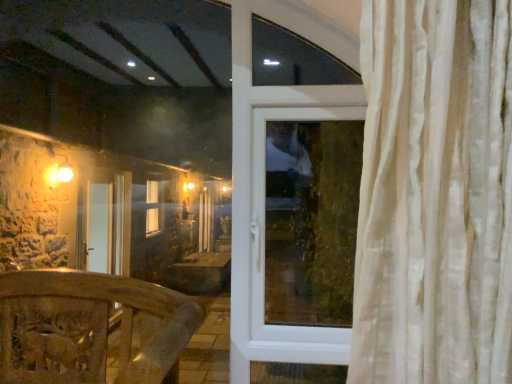
Describe the element at coordinates (92, 327) in the screenshot. This screenshot has height=384, width=512. I see `wooden carved railing at lower left` at that location.

What are the coordinates of `wooden carved railing at lower left` in the screenshot? It's located at (92, 327).

You are a GUI agent. You are given a task and a screenshot of the screen. Output one action in this format:
    pyautogui.click(x=<x>, y=<y>)
    Task: Click on the transparent glass window at center
    The width and height of the screenshot is (512, 384).
    Given the screenshot: What is the action you would take?
    pyautogui.click(x=304, y=219)

What do you see at coordinates (304, 219) in the screenshot?
I see `transparent glass window at center` at bounding box center [304, 219].

Identify the location of wooden carved railing at lower left. The height and width of the screenshot is (384, 512). (92, 327).

Is transparent glass window at center at the right side of wooden carved railing at lower left?

Yes.

Considering the relative positions of transparent glass window at center and wooden carved railing at lower left in the image provided, is transparent glass window at center in front of wooden carved railing at lower left?

That is False.

Which point is more forward, (268, 232) or (139, 359)?

Positioned in front is point (139, 359).

From the image's perspective, is transparent glass window at center on top of wooden carved railing at lower left?

Yes, from the image's perspective, transparent glass window at center is on top of wooden carved railing at lower left.

From a real-world perspective, is transparent glass window at center below wooden carved railing at lower left?

No, from a real-world perspective, transparent glass window at center is not under wooden carved railing at lower left.

From the picture: Can you confirm if transparent glass window at center is wider than wooden carved railing at lower left?

Incorrect, the width of transparent glass window at center does not surpass that of wooden carved railing at lower left.

Considering the sizes of transparent glass window at center and wooden carved railing at lower left in the image, is transparent glass window at center taller or shorter than wooden carved railing at lower left?

Clearly, transparent glass window at center is taller compared to wooden carved railing at lower left.

Can you confirm if transparent glass window at center is smaller than wooden carved railing at lower left?

Yes, transparent glass window at center is smaller than wooden carved railing at lower left.

Is wooden carved railing at lower left a part of transparent glass window at center?

Definitely not — wooden carved railing at lower left is not inside transparent glass window at center.

Is transparent glass window at center next to wooden carved railing at lower left?

transparent glass window at center and wooden carved railing at lower left are not in contact.

Could you tell me if transparent glass window at center is turned towards wooden carved railing at lower left?

No, transparent glass window at center is not aimed at wooden carved railing at lower left.

How far apart are transparent glass window at center and wooden carved railing at lower left?

A distance of 23.21 inches exists between transparent glass window at center and wooden carved railing at lower left.

Where is `furniture below the transparent glass window at center (from the image's perspective)`? This screenshot has width=512, height=384. furniture below the transparent glass window at center (from the image's perspective) is located at coordinates (92, 327).

Based on the photo, based on their positions, is wooden carved railing at lower left located to the left or right of transparent glass window at center?

wooden carved railing at lower left is to the left of transparent glass window at center.

Is wooden carved railing at lower left positioned in front of transparent glass window at center?

Yes.

Is point (92, 344) farther from viewer compared to point (263, 123)?

No, (92, 344) is in front of (263, 123).

From the image's perspective, which object appears higher, wooden carved railing at lower left or transparent glass window at center?

transparent glass window at center appears higher in the image.

From a real-world perspective, is wooden carved railing at lower left physically located above or below transparent glass window at center?

From a real-world perspective, wooden carved railing at lower left is physically below transparent glass window at center.

Which object is thinner, wooden carved railing at lower left or transparent glass window at center?

Thinner between the two is transparent glass window at center.

Considering the sizes of objects wooden carved railing at lower left and transparent glass window at center in the image provided, who is shorter, wooden carved railing at lower left or transparent glass window at center?

With less height is wooden carved railing at lower left.

Between wooden carved railing at lower left and transparent glass window at center, which one has smaller size?

With smaller size is transparent glass window at center.

Can transparent glass window at center be found inside wooden carved railing at lower left?

No, transparent glass window at center is not inside wooden carved railing at lower left.

Is wooden carved railing at lower left with transparent glass window at center?

wooden carved railing at lower left and transparent glass window at center are not in contact.

Is wooden carved railing at lower left positioned with its back to transparent glass window at center?

No, wooden carved railing at lower left is not facing away from transparent glass window at center.

Can you tell me how much wooden carved railing at lower left and transparent glass window at center differ in facing direction?

1.57 degrees.

How distant is wooden carved railing at lower left from transparent glass window at center?

wooden carved railing at lower left and transparent glass window at center are 23.21 inches apart from each other.

Find the location of `window above the wooden carved railing at lower left (from a real-world perspective)`. window above the wooden carved railing at lower left (from a real-world perspective) is located at coordinates (304, 219).

You are a GUI agent. You are given a task and a screenshot of the screen. Output one action in this format:
    pyautogui.click(x=<x>, y=<y>)
    Task: Click on the furniture that appears below the transparent glass window at center (from the image's perspective)
    This screenshot has width=512, height=384.
    Given the screenshot: What is the action you would take?
    pyautogui.click(x=92, y=327)

Identify the location of furniture lying on the left of transparent glass window at center. This screenshot has width=512, height=384. (92, 327).